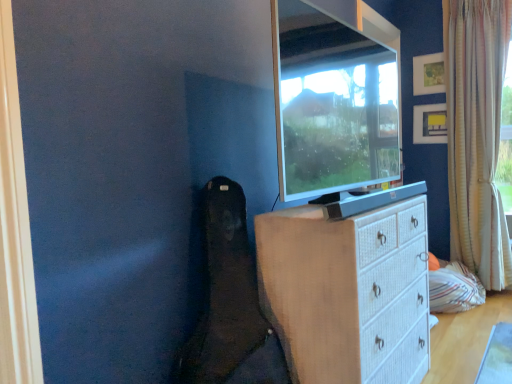
Measure the distance between point (419, 123) and camera.

Point (419, 123) and camera are 11.30 feet apart from each other.

In order to click on white textured curtain at right in this screenshot , I will do `click(476, 135)`.

Find the location of `matte white picture frame at upper right, positioned as the first picture frame in top-to-bottom order`. matte white picture frame at upper right, positioned as the first picture frame in top-to-bottom order is located at coordinates (428, 74).

Describe the element at coordinates (428, 74) in the screenshot. I see `matte white picture frame at upper right, positioned as the first picture frame in top-to-bottom order` at that location.

Find the location of a particular element. matte yellow picture frame at upper right, which appears as the 2th picture frame when viewed from the top is located at coordinates (429, 124).

Looking at this image, which is nearer, (439, 142) or (431, 63)?

Positioned in front is point (431, 63).

Can we say matte yellow picture frame at upper right, which appears as the 2th picture frame when viewed from the top, lies outside matte white picture frame at upper right, positioned as the first picture frame in top-to-bottom order?

Yes.

From a real-world perspective, is matte yellow picture frame at upper right, which appears as the 2th picture frame when viewed from the top, positioned above or below matte white picture frame at upper right, positioned as the first picture frame in top-to-bottom order?

matte yellow picture frame at upper right, which appears as the 2th picture frame when viewed from the top, is situated lower than matte white picture frame at upper right, positioned as the first picture frame in top-to-bottom order, in the real world.

Considering the sizes of objects matte yellow picture frame at upper right, which appears as the 2th picture frame when viewed from the top, and matte white picture frame at upper right, positioned as the first picture frame in top-to-bottom order, in the image provided, who is thinner, matte yellow picture frame at upper right, which appears as the 2th picture frame when viewed from the top, or matte white picture frame at upper right, positioned as the first picture frame in top-to-bottom order,?

matte yellow picture frame at upper right, which appears as the 2th picture frame when viewed from the top, is thinner.

Considering the relative positions of matte yellow picture frame at upper right, which appears as the 2th picture frame when viewed from the top, and white wicker chest of drawers at center in the image provided, is matte yellow picture frame at upper right, which appears as the 2th picture frame when viewed from the top, behind white wicker chest of drawers at center?

Yes, matte yellow picture frame at upper right, which appears as the 2th picture frame when viewed from the top, is further from the viewer.

From the image's perspective, is matte yellow picture frame at upper right, which appears as the 2th picture frame when viewed from the top, below white wicker chest of drawers at center?

No, from the image's perspective, matte yellow picture frame at upper right, which appears as the 2th picture frame when viewed from the top, is not below white wicker chest of drawers at center.

How far apart are matte yellow picture frame at upper right, the first picture frame in the bottom-to-top sequence, and white wicker chest of drawers at center?

matte yellow picture frame at upper right, the first picture frame in the bottom-to-top sequence, is 2.06 meters from white wicker chest of drawers at center.

Is white wicker chest of drawers at center at the back of matte yellow picture frame at upper right, the first picture frame in the bottom-to-top sequence?

matte yellow picture frame at upper right, the first picture frame in the bottom-to-top sequence, does not have its back to white wicker chest of drawers at center.

Does point (424, 93) appear closer or farther from the camera than point (378, 30)?

Point (424, 93).

From the image's perspective, is matte white picture frame at upper right, positioned as the first picture frame in top-to-bottom order, below matte black tv at upper center?

Actually, matte white picture frame at upper right, positioned as the first picture frame in top-to-bottom order, appears above matte black tv at upper center in the image.

Could you tell me if matte white picture frame at upper right, acting as the 2th picture frame starting from the bottom, is facing matte black tv at upper center?

Yes.

Who is shorter, matte white picture frame at upper right, positioned as the first picture frame in top-to-bottom order, or matte black tv at upper center?

matte white picture frame at upper right, positioned as the first picture frame in top-to-bottom order, is shorter.

Find the location of a particular element. Image resolution: width=512 pixels, height=384 pixels. the 1st picture frame to the right of the matte black tv at upper center, counting from the anchor's position is located at coordinates (428, 74).

Is matte white picture frame at upper right, acting as the 2th picture frame starting from the bottom, inside matte black tv at upper center?

Definitely not — matte white picture frame at upper right, acting as the 2th picture frame starting from the bottom, is not inside matte black tv at upper center.

Is point (282, 6) in front of point (436, 89)?

Yes, it is in front of point (436, 89).

From a real-world perspective, relative to matte yellow picture frame at upper right, the first picture frame in the bottom-to-top sequence, is matte white picture frame at upper right, acting as the 2th picture frame starting from the bottom, vertically above or below?

matte white picture frame at upper right, acting as the 2th picture frame starting from the bottom, is situated higher than matte yellow picture frame at upper right, the first picture frame in the bottom-to-top sequence, in the real world.

The width and height of the screenshot is (512, 384). What are the coordinates of `picture frame positioned vertically above the matte yellow picture frame at upper right, the first picture frame in the bottom-to-top sequence (from a real-world perspective)` in the screenshot? It's located at (428, 74).

Does matte white picture frame at upper right, positioned as the first picture frame in top-to-bottom order, have a lesser width compared to matte yellow picture frame at upper right, which appears as the 2th picture frame when viewed from the top?

In fact, matte white picture frame at upper right, positioned as the first picture frame in top-to-bottom order, might be wider than matte yellow picture frame at upper right, which appears as the 2th picture frame when viewed from the top.

Does matte white picture frame at upper right, positioned as the first picture frame in top-to-bottom order, lie in front of matte yellow picture frame at upper right, which appears as the 2th picture frame when viewed from the top?

Yes, it is.

Considering the points (499, 71) and (302, 353), which point is in front, point (499, 71) or point (302, 353)?

The point (302, 353) is closer.

Is white textured curtain at right not inside white wicker chest of drawers at center?

Yes, white textured curtain at right is not within white wicker chest of drawers at center.

Which of these two, white textured curtain at right or white wicker chest of drawers at center, stands taller?

With more height is white textured curtain at right.

Between white textured curtain at right and white wicker chest of drawers at center, which one has smaller width?

white textured curtain at right.

Considering the relative positions of white wicker chest of drawers at center and matte black tv at upper center in the image provided, is white wicker chest of drawers at center to the right of matte black tv at upper center from the viewer's perspective?

Incorrect, white wicker chest of drawers at center is not on the right side of matte black tv at upper center.

From the image's perspective, is white wicker chest of drawers at center over matte black tv at upper center?

No, from the image's perspective, white wicker chest of drawers at center is not on top of matte black tv at upper center.

Could you tell me if white wicker chest of drawers at center is turned towards matte black tv at upper center?

No.

Who is taller, white wicker chest of drawers at center or matte black tv at upper center?

With more height is white wicker chest of drawers at center.

Find the location of a particular element. This screenshot has width=512, height=384. picture frame on the left of matte yellow picture frame at upper right, the first picture frame in the bottom-to-top sequence is located at coordinates (428, 74).

This screenshot has width=512, height=384. There is a white wicker chest of drawers at center. Find the location of `the 1st picture frame above it (from the image's perspective)`. the 1st picture frame above it (from the image's perspective) is located at coordinates (429, 124).

Looking at the image, which one is located closer to matte yellow picture frame at upper right, which appears as the 2th picture frame when viewed from the top, white wicker chest of drawers at center or white textured curtain at right?

white textured curtain at right is positioned closer to the anchor matte yellow picture frame at upper right, which appears as the 2th picture frame when viewed from the top.

Considering their positions, is white textured curtain at right positioned closer to matte black tv at upper center than matte white picture frame at upper right, acting as the 2th picture frame starting from the bottom?

The object closer to matte black tv at upper center is white textured curtain at right.

Which object lies nearer to the anchor point white textured curtain at right, matte black tv at upper center or matte yellow picture frame at upper right, which appears as the 2th picture frame when viewed from the top?

The object closer to white textured curtain at right is matte yellow picture frame at upper right, which appears as the 2th picture frame when viewed from the top.

When comparing their distances from white wicker chest of drawers at center, does white textured curtain at right or matte black tv at upper center seem further?

Among the two, white textured curtain at right is located further to white wicker chest of drawers at center.

Which object lies further to the anchor point matte white picture frame at upper right, positioned as the first picture frame in top-to-bottom order, white textured curtain at right or matte yellow picture frame at upper right, the first picture frame in the bottom-to-top sequence?

white textured curtain at right lies further to matte white picture frame at upper right, positioned as the first picture frame in top-to-bottom order, than the other object.

From the image, which object appears to be nearer to matte white picture frame at upper right, positioned as the first picture frame in top-to-bottom order, white textured curtain at right or matte black tv at upper center?

The object closer to matte white picture frame at upper right, positioned as the first picture frame in top-to-bottom order, is white textured curtain at right.

Considering their positions, is matte white picture frame at upper right, positioned as the first picture frame in top-to-bottom order, positioned further to white textured curtain at right than matte black tv at upper center?

matte black tv at upper center.

From the image, which object appears to be farther from matte yellow picture frame at upper right, the first picture frame in the bottom-to-top sequence, white wicker chest of drawers at center or matte black tv at upper center?

Among the two, white wicker chest of drawers at center is located further to matte yellow picture frame at upper right, the first picture frame in the bottom-to-top sequence.

Image resolution: width=512 pixels, height=384 pixels. I want to click on curtain positioned between white wicker chest of drawers at center and matte white picture frame at upper right, acting as the 2th picture frame starting from the bottom, from near to far, so click(x=476, y=135).

I want to click on picture frame between white textured curtain at right and matte yellow picture frame at upper right, the first picture frame in the bottom-to-top sequence, from front to back, so point(428,74).

Where is `chest of drawers between matte black tv at upper center and white textured curtain at right along the z-axis`? The image size is (512, 384). chest of drawers between matte black tv at upper center and white textured curtain at right along the z-axis is located at coordinates (348, 289).

This screenshot has width=512, height=384. Identify the location of curtain between matte black tv at upper center and matte white picture frame at upper right, positioned as the first picture frame in top-to-bottom order, from front to back. (476, 135).